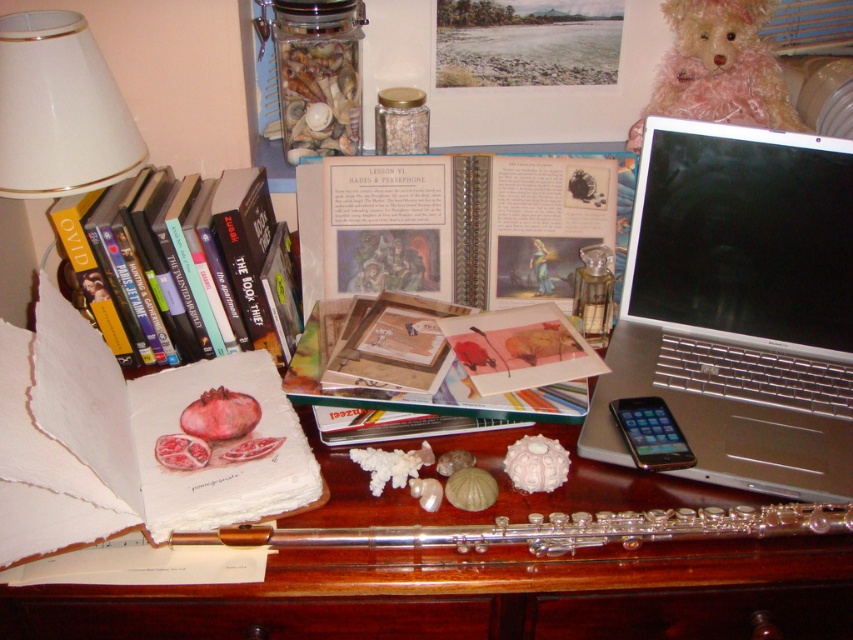
Question: Which point is farther to the camera?

Choices:
 (A) white glossy lampshade at upper left
 (B) wooden desk at center
 (C) fuzzy pink teddy bear at upper right
 (D) hardcover book at left

Answer: (C)

Question: In this image, where is hardcover book at left located relative to fuzzy pink teddy bear at upper right?

Choices:
 (A) above
 (B) below

Answer: (B)

Question: Which object appears farthest from the camera in this image?

Choices:
 (A) matte paper sketchbook at center-left
 (B) fuzzy pink teddy bear at upper right
 (C) hardcover book at left
 (D) white glossy lampshade at upper left

Answer: (B)

Question: Is wooden desk at center below wooden textured book at center?

Choices:
 (A) yes
 (B) no

Answer: (A)

Question: Can you confirm if wooden desk at center is smaller than silver metallic laptop at right?

Choices:
 (A) yes
 (B) no

Answer: (B)

Question: Which point appears farthest from the camera in this image?

Choices:
 (A) (733, 410)
 (B) (462, 380)
 (C) (194, 634)
 (D) (201, 243)

Answer: (D)